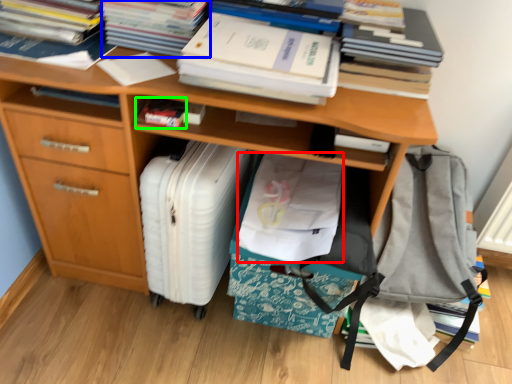
Question: Considering the real-world distances, which object is closest to material (highlighted by a red box)? paperback book (highlighted by a blue box) or paperback book (highlighted by a green box).

Choices:
 (A) paperback book
 (B) paperback book

Answer: (B)